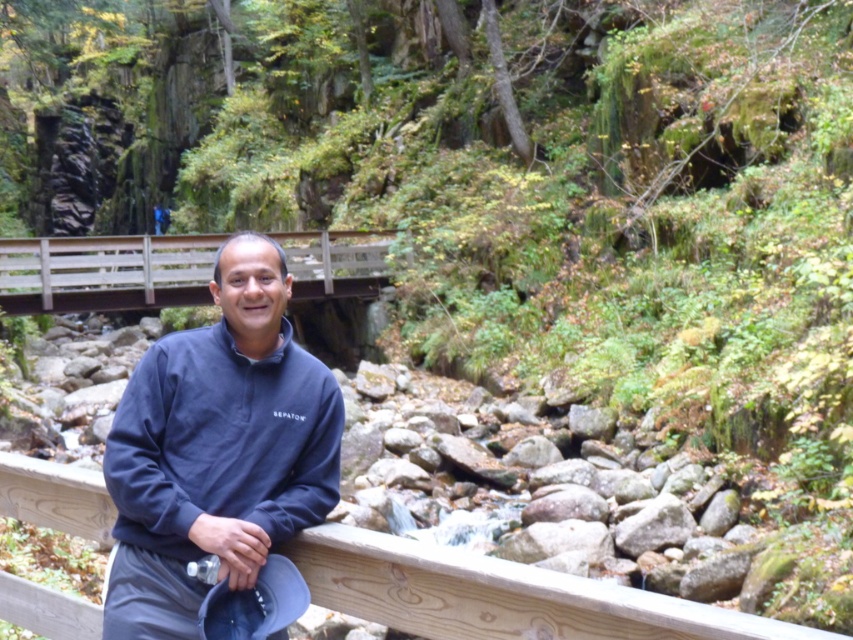
Question: Which point is farther from the camera taking this photo?

Choices:
 (A) (206, 440)
 (B) (418, 582)

Answer: (A)

Question: Which object appears farthest from the camera in this image?

Choices:
 (A) wooden bridge at center
 (B) wooden rail at center
 (C) navy fleece sweater at center

Answer: (A)

Question: Can you confirm if wooden rail at center is bigger than wooden bridge at center?

Choices:
 (A) no
 (B) yes

Answer: (A)

Question: Is navy fleece sweater at center wider than wooden rail at center?

Choices:
 (A) yes
 (B) no

Answer: (B)

Question: Which point is farther from the camera taking this photo?

Choices:
 (A) (x=74, y=268)
 (B) (x=498, y=588)
 (C) (x=142, y=556)

Answer: (A)

Question: Can you confirm if navy fleece sweater at center is smaller than wooden bridge at center?

Choices:
 (A) yes
 (B) no

Answer: (A)